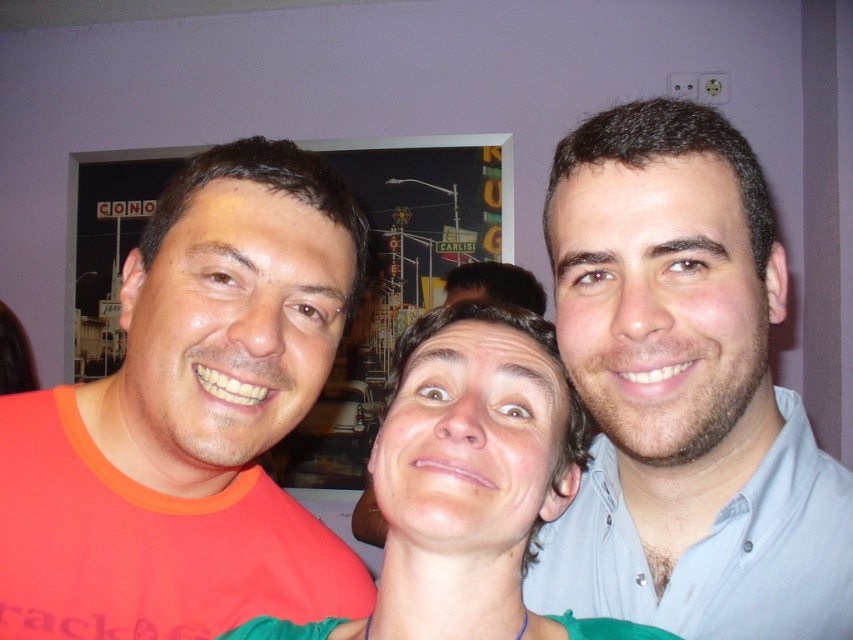
You are a photographer trying to adjust the lighting for a group photo. You notice the light blue shirt at right and the smooth skin face at center. Which object is positioned higher in the image?

The light blue shirt at right is above the smooth skin face at center, so it is positioned higher in the image.